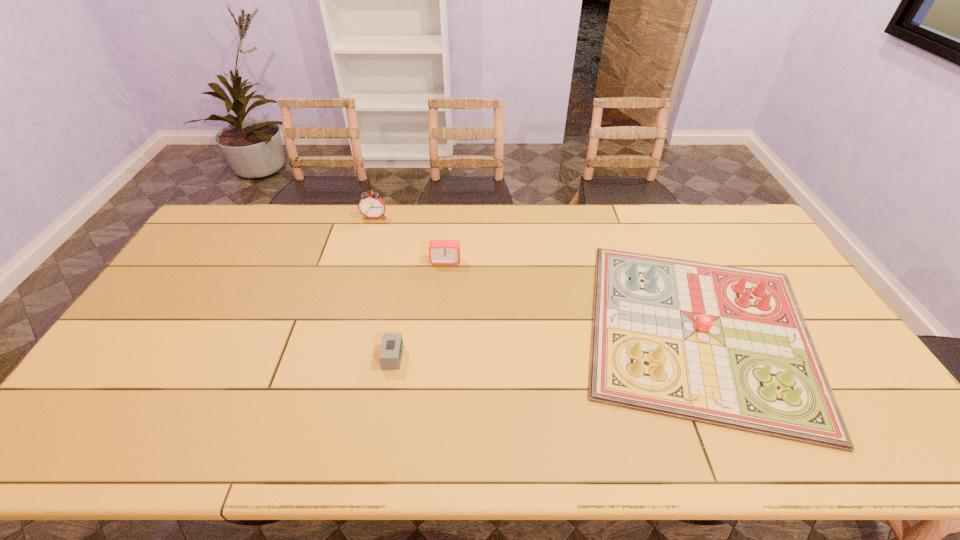
Locate an element on the screen. The width and height of the screenshot is (960, 540). the tallest alarm clock is located at coordinates (371, 205).

Find the location of `the farthest alarm clock`. the farthest alarm clock is located at coordinates (371, 205).

Locate an element on the screen. Image resolution: width=960 pixels, height=540 pixels. the third object from left to right is located at coordinates (440, 251).

Identify the location of the rightmost alarm clock. Image resolution: width=960 pixels, height=540 pixels. pos(440,251).

Identify the location of gameboard. The height and width of the screenshot is (540, 960). (727, 346).

The height and width of the screenshot is (540, 960). Identify the location of the rightmost object. (727, 346).

Identify the location of the shortest object. Image resolution: width=960 pixels, height=540 pixels. (390, 356).

Find the location of a particular element. This screenshot has width=960, height=540. the second alarm clock from right to left is located at coordinates (390, 356).

Locate an element on the screen. The height and width of the screenshot is (540, 960). free space located 0.390m on the clock face of the tallest alarm clock is located at coordinates (351, 298).

Where is `vacant area situated 0.070m on the front-facing side of the rightmost alarm clock`? vacant area situated 0.070m on the front-facing side of the rightmost alarm clock is located at coordinates (444, 280).